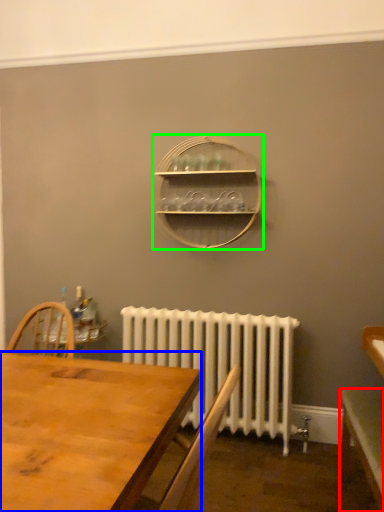
Question: Considering the real-world distances, which object is closest to table (highlighted by a red box)? desk (highlighted by a blue box) or shelf (highlighted by a green box).

Choices:
 (A) desk
 (B) shelf

Answer: (A)